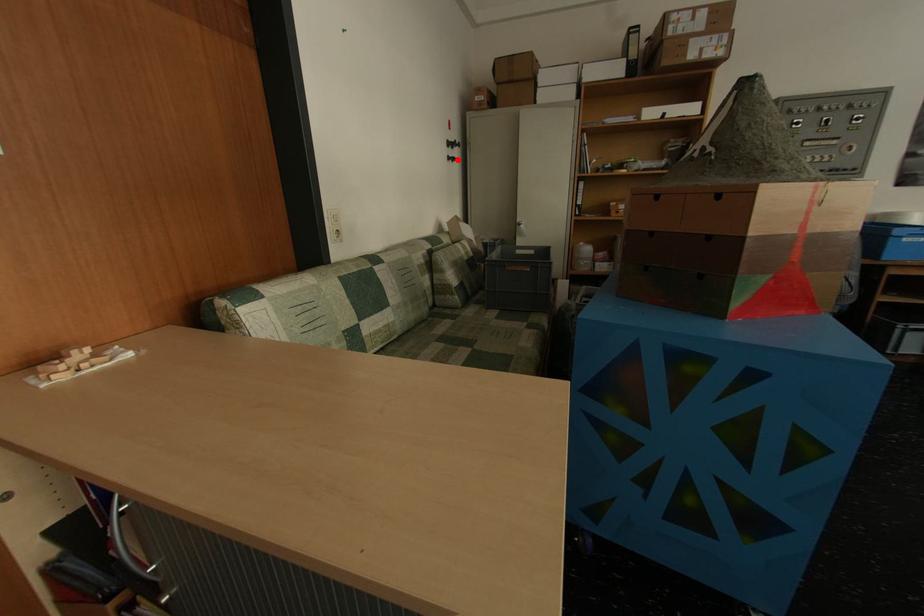
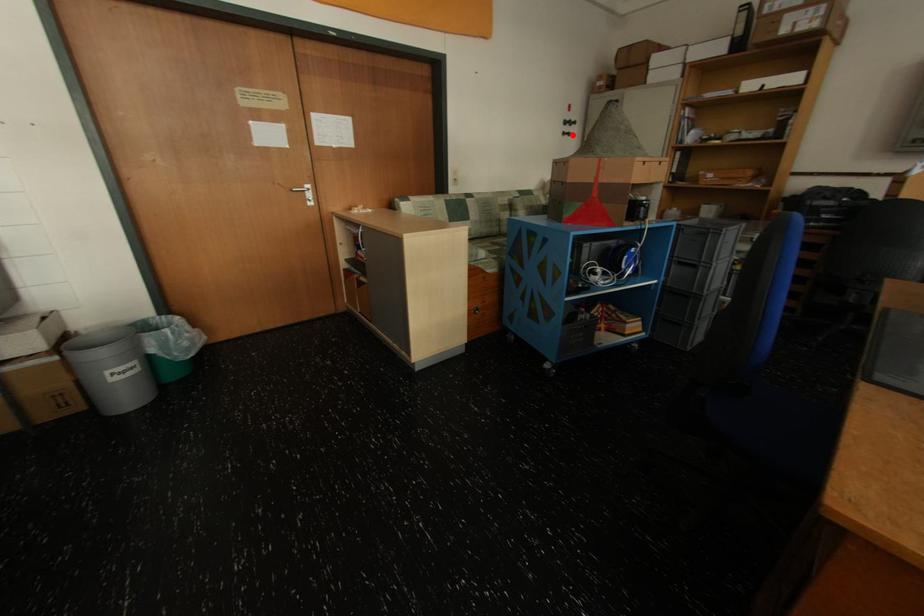
I am providing you with two images of the same scene from different viewpoints. A red point is marked on the first image and another point is marked on the second image. Is the marked point in image1 the same physical position as the marked point in image2?

Yes